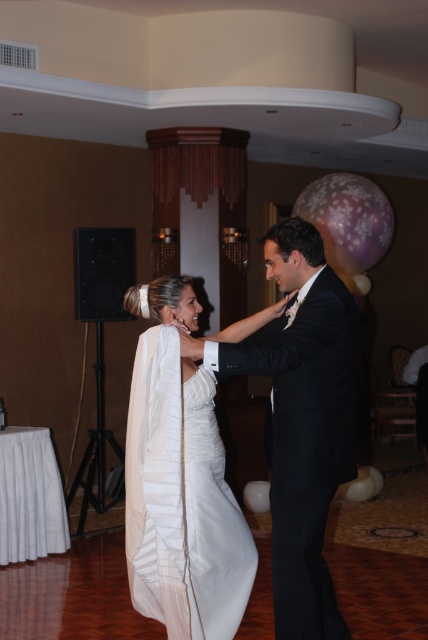
Question: Which point is farther from the camera taking this photo?

Choices:
 (A) (287, 397)
 (B) (166, 573)

Answer: (B)

Question: Does black satin suit at center have a larger size compared to satin white dress at center?

Choices:
 (A) yes
 (B) no

Answer: (A)

Question: Is black satin suit at center positioned behind satin white dress at center?

Choices:
 (A) yes
 (B) no

Answer: (B)

Question: Which object appears farthest from the camera in this image?

Choices:
 (A) black satin suit at center
 (B) satin white dress at center

Answer: (B)

Question: Which object is farther from the camera taking this photo?

Choices:
 (A) satin white dress at center
 (B) black satin suit at center

Answer: (A)

Question: Is black satin suit at center further to the viewer compared to satin white dress at center?

Choices:
 (A) yes
 (B) no

Answer: (B)